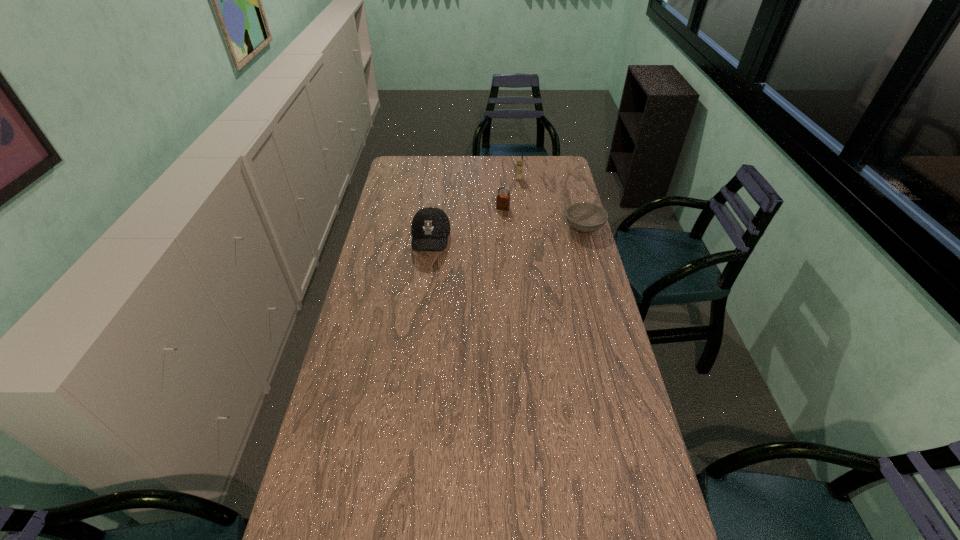
I want to click on vacant spot on the desktop that is between the leftmost object and the bowl and is positioned on the front of the tallest object, where the keypad is located, so click(518, 233).

Identify the location of free space on the desktop that is between the leftmost object and the rightmost object and is positioned on the front-facing side of the second farthest object. The width and height of the screenshot is (960, 540). (491, 235).